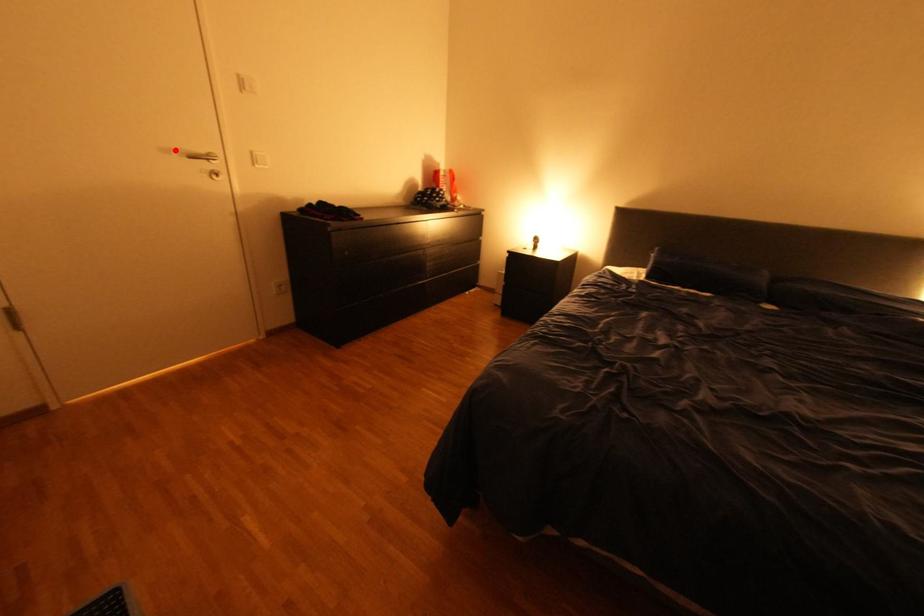
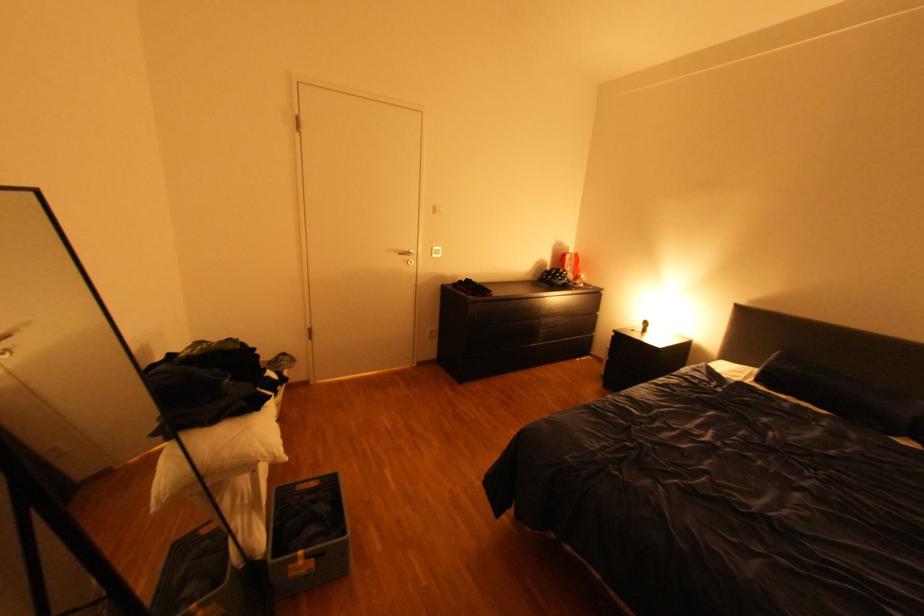
Where in the second image is the point corresponding to the highlighted location from the first image?

(399, 249)